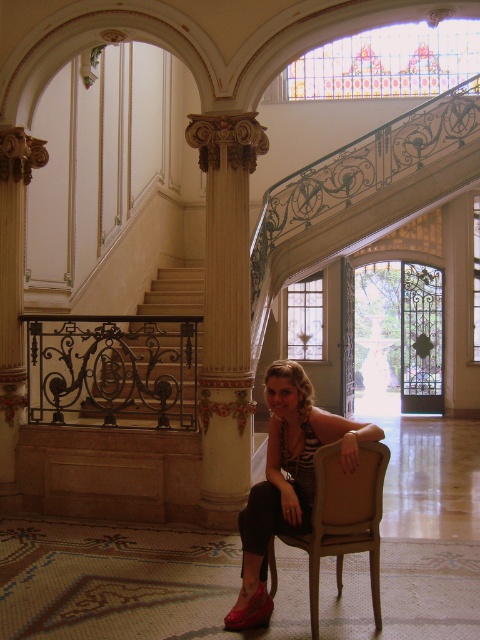
Question: Which object is positioned closest to the shiny red shoe at lower center?

Choices:
 (A) matte black dress at center
 (B) white marble column at left
 (C) white marble column at center

Answer: (A)

Question: Can you confirm if matte black dress at center is positioned to the right of shiny red shoe at lower center?

Choices:
 (A) no
 (B) yes

Answer: (B)

Question: Does matte black dress at center appear on the left side of shiny red shoe at lower center?

Choices:
 (A) no
 (B) yes

Answer: (A)

Question: Among these objects, which one is farthest from the camera?

Choices:
 (A) shiny red shoe at lower center
 (B) white marble column at center

Answer: (B)

Question: Does white marble column at center have a lesser width compared to shiny red shoe at lower center?

Choices:
 (A) yes
 (B) no

Answer: (B)

Question: Which point appears closest to the camera in this image?

Choices:
 (A) (240, 467)
 (B) (3, 196)
 (C) (226, 616)

Answer: (C)